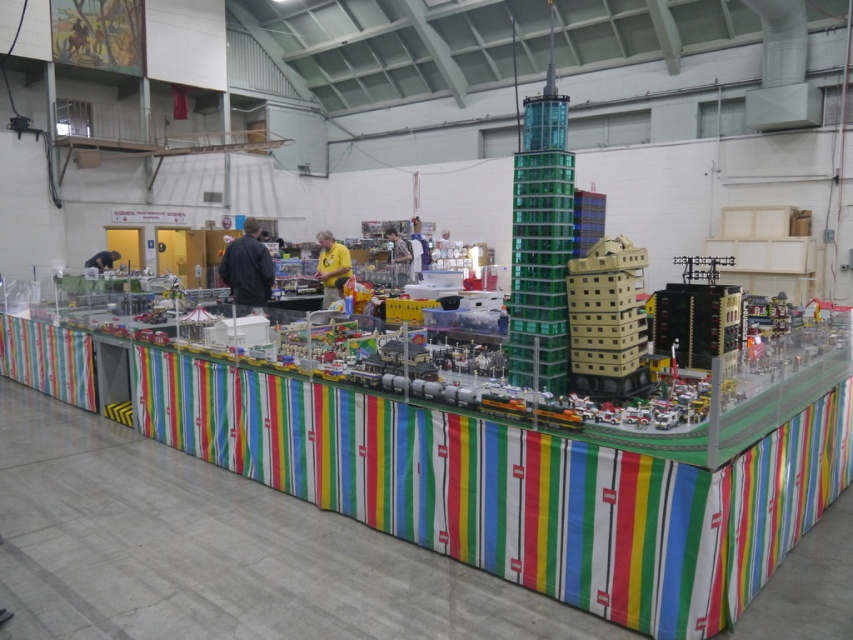
You are standing in the exhibition hall and want to locate the point marked at coordinates (541, 241) on the Lego cityscape model. According to the description, where exactly is this point located?

The point marked at coordinates (541, 241) is located on the transparent green glass tower at center.

You are an architect visiting the Lego city model. You notice the transparent green glass tower at center and the beige plastic building at center. Which one is positioned higher in the vertical direction?

The transparent green glass tower at center is positioned higher than the beige plastic building at center because it is above it.